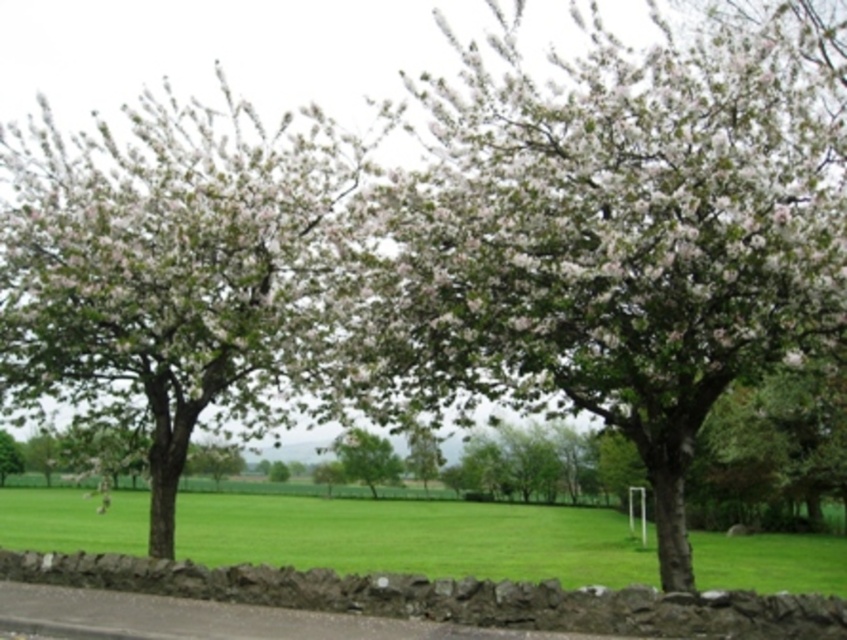
In the scene shown: You are standing in the outdoor scene and want to walk towards the green grass at center. Which direction should you move relative to the white blossoming tree at center?

The green grass at center is closer to the viewer than the white blossoming tree at center, so you should move towards the green grass at center, which is in front of the white blossoming tree at center.

You are standing in the serene outdoor scene and want to find a spot to place a picnic blanket. You notice the green grass at center and the green leafy tree at center. Which object is positioned lower in the scene?

The green grass at center is located below the green leafy tree at center, so it is positioned lower in the scene.